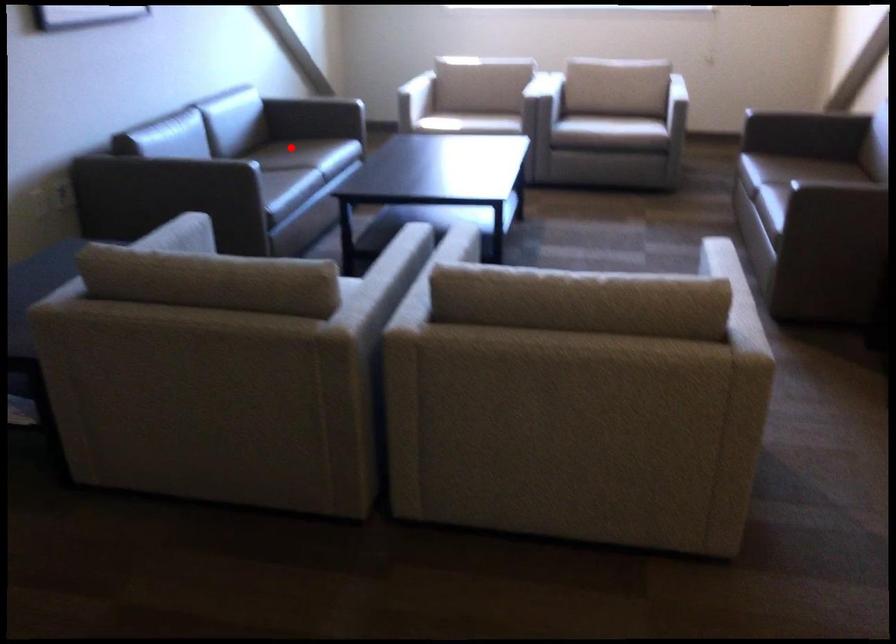
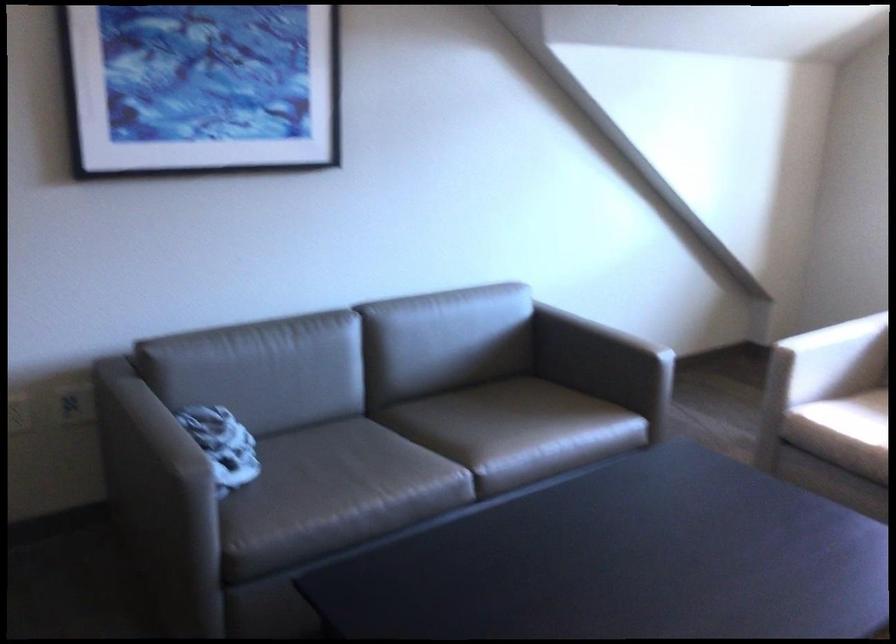
The point at the highlighted location is marked in the first image. Where is the corresponding point in the second image?

(497, 430)